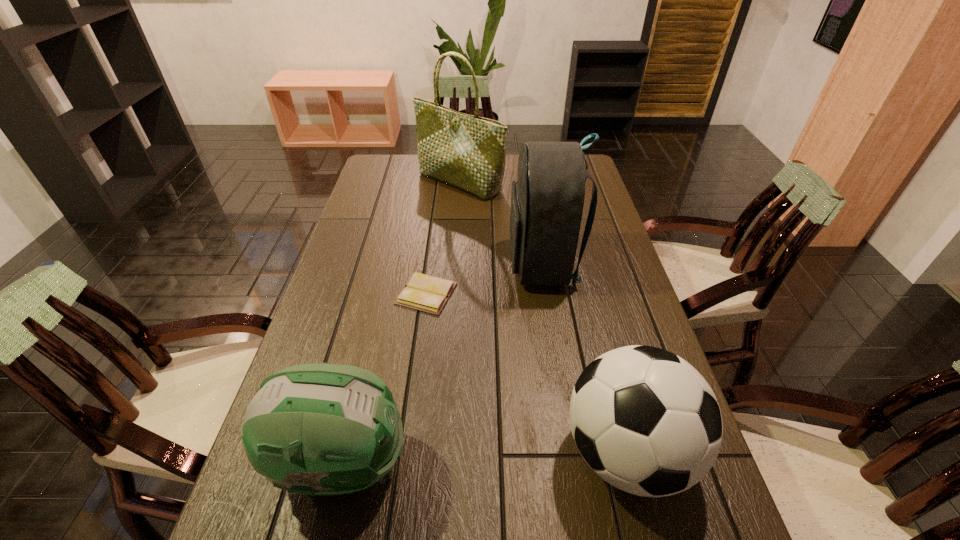
Locate which object ranks in proximity to the farthest object. Please provide its 2D coordinates. Your answer should be formatted as a tuple, i.e. [(x, y)], where the tuple contains the x and y coordinates of a point satisfying the conditions above.

[(547, 201)]

Select which object appears as the fourth closest to the shopping bag. Please provide its 2D coordinates. Your answer should be formatted as a tuple, i.e. [(x, y)], where the tuple contains the x and y coordinates of a point satisfying the conditions above.

[(312, 429)]

This screenshot has width=960, height=540. In order to click on free spot that satisfies the following two spatial constraints: 1. on the front-facing side of the backpack; 2. on the front side of the shortest object in this screenshot , I will do `click(547, 293)`.

The height and width of the screenshot is (540, 960). Find the location of `free region that satisfies the following two spatial constraints: 1. on the back side of the shortest object; 2. on the right side of the farthest object`. free region that satisfies the following two spatial constraints: 1. on the back side of the shortest object; 2. on the right side of the farthest object is located at coordinates (441, 183).

Where is `vacant position in the image that satisfies the following two spatial constraints: 1. on the front side of the farthest object; 2. on the left side of the soccer ball`? Image resolution: width=960 pixels, height=540 pixels. vacant position in the image that satisfies the following two spatial constraints: 1. on the front side of the farthest object; 2. on the left side of the soccer ball is located at coordinates (442, 453).

The height and width of the screenshot is (540, 960). What are the coordinates of `blank space that satisfies the following two spatial constraints: 1. on the front-facing side of the backpack; 2. on the front side of the diary` in the screenshot? It's located at (547, 293).

Locate an element on the screen. vacant space that satisfies the following two spatial constraints: 1. on the front-facing side of the backpack; 2. on the left side of the soccer ball is located at coordinates (573, 453).

The height and width of the screenshot is (540, 960). I want to click on free space that satisfies the following two spatial constraints: 1. on the front side of the soccer ball; 2. on the visor of the football helmet, so click(x=630, y=463).